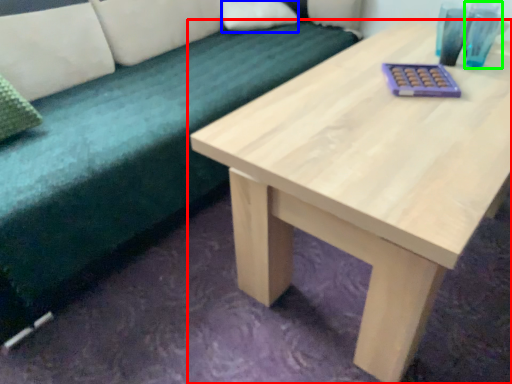
Question: Which is farther away from table (highlighted by a red box)? pillow (highlighted by a blue box) or teal (highlighted by a green box)?

Choices:
 (A) pillow
 (B) teal

Answer: (A)